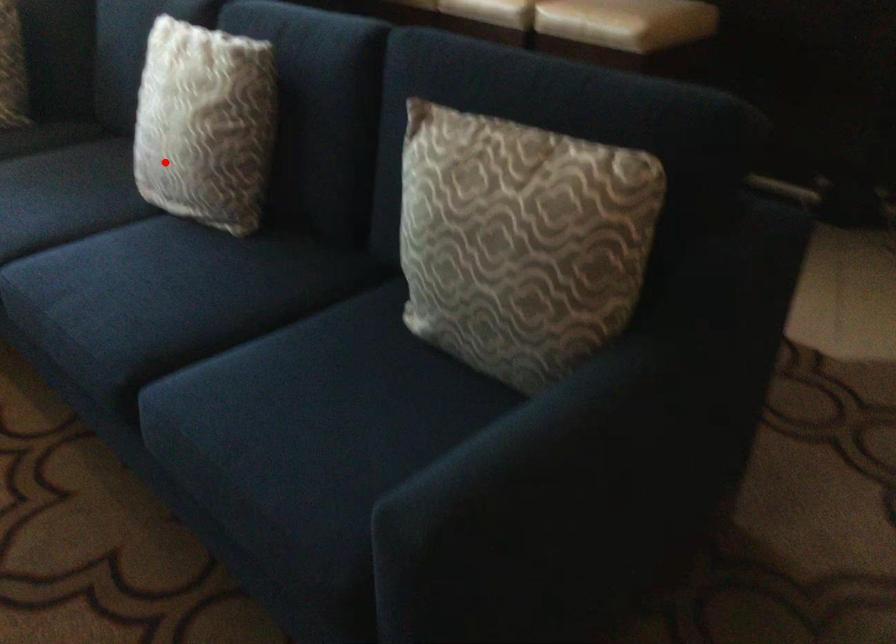
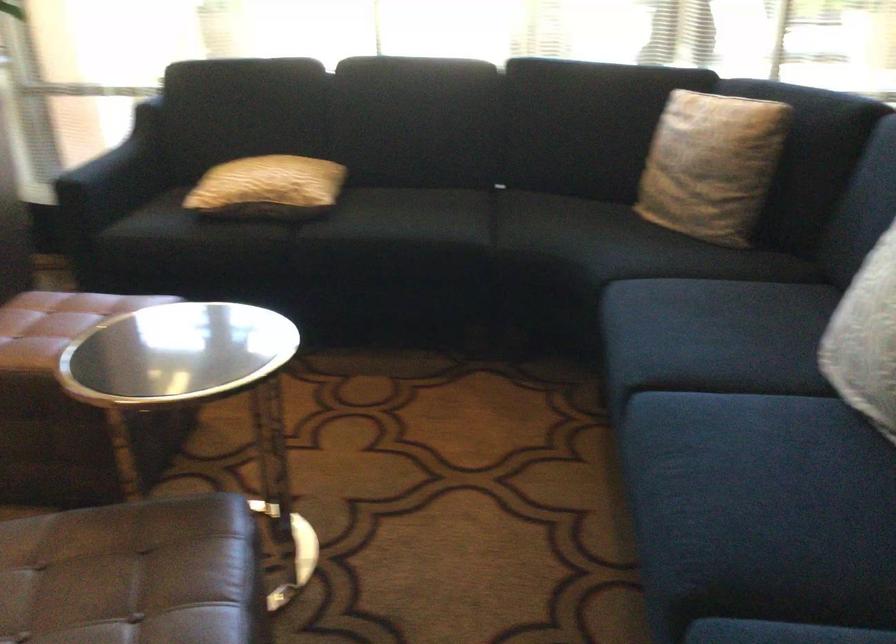
Question: I am providing you with two images of the same scene from different viewpoints. Image1 has a red point marked. In image2, the corresponding 3D location appears at what relative position? Reply with the corresponding letter.

Choices:
 (A) Closer
 (B) Farther

Answer: (A)